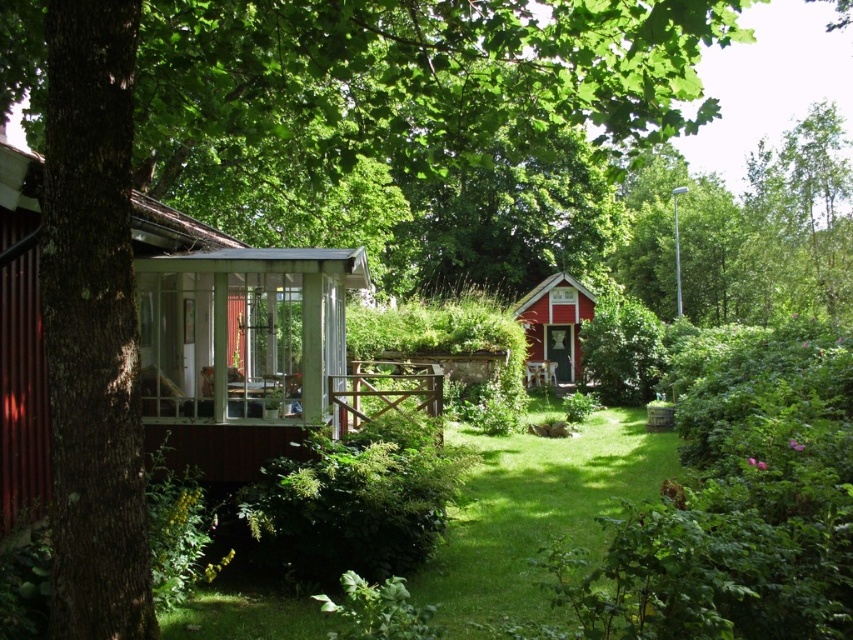
Question: Which object is the closest to the matte red wooden cottage at center?

Choices:
 (A) transparent glass porch at center
 (B) wooden cottage at left
 (C) green grass at center

Answer: (C)

Question: Is green grass at center to the left of transparent glass porch at center from the viewer's perspective?

Choices:
 (A) yes
 (B) no

Answer: (B)

Question: Considering the real-world distances, which object is farthest from the matte red wooden cottage at center?

Choices:
 (A) transparent glass porch at center
 (B) wooden cottage at left
 (C) green grass at center

Answer: (A)

Question: Which point appears farthest from the camera in this image?

Choices:
 (A) (434, 364)
 (B) (650, 477)

Answer: (A)

Question: Does green grass at center appear over matte red wooden cottage at center?

Choices:
 (A) no
 (B) yes

Answer: (A)

Question: Can you confirm if wooden cottage at left is bigger than matte red wooden cottage at center?

Choices:
 (A) yes
 (B) no

Answer: (B)